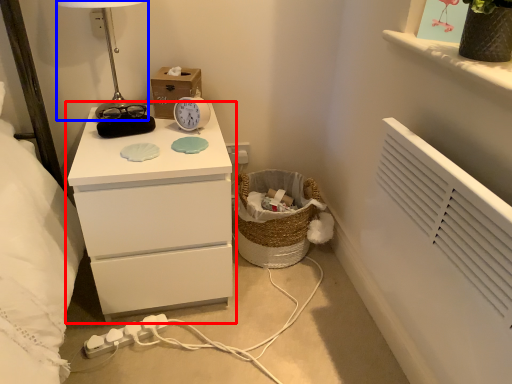
Question: Which point is closer to the camera, chest of drawers (highlighted by a red box) or table lamp (highlighted by a blue box)?

Choices:
 (A) chest of drawers
 (B) table lamp

Answer: (A)